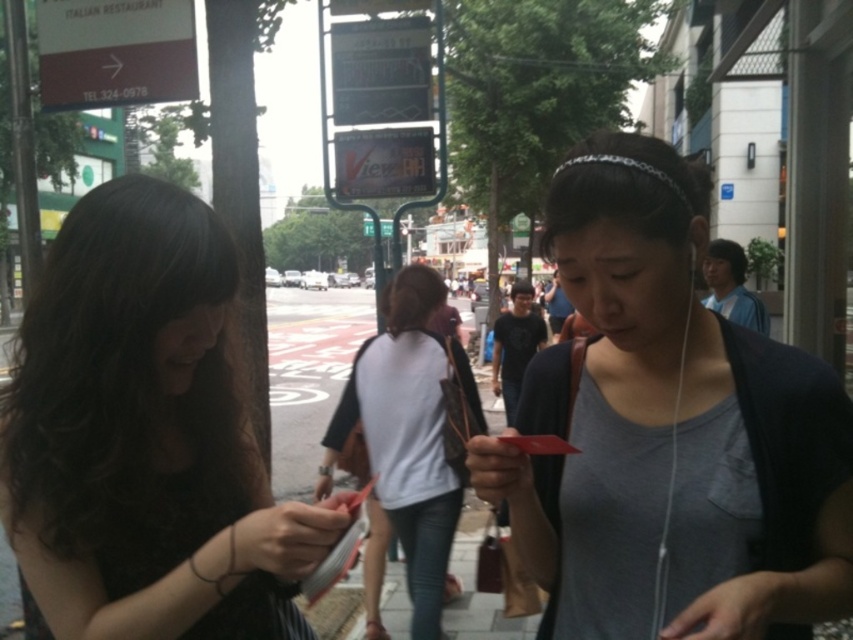
Question: Which object is the farthest from the white cotton shirt at center?

Choices:
 (A) gray matte tank top at center
 (B) dark brown hair at left

Answer: (B)

Question: Which object is the closest to the gray matte tank top at center?

Choices:
 (A) white cotton shirt at center
 (B) dark brown hair at left

Answer: (B)

Question: Estimate the real-world distances between objects in this image. Which object is closer to the white cotton shirt at center?

Choices:
 (A) dark brown hair at left
 (B) gray matte tank top at center

Answer: (B)

Question: Does gray matte tank top at center appear on the left side of white cotton shirt at center?

Choices:
 (A) no
 (B) yes

Answer: (A)

Question: Does dark brown hair at left have a lesser width compared to white cotton shirt at center?

Choices:
 (A) yes
 (B) no

Answer: (A)

Question: Does dark brown hair at left have a greater width compared to gray matte tank top at center?

Choices:
 (A) yes
 (B) no

Answer: (B)